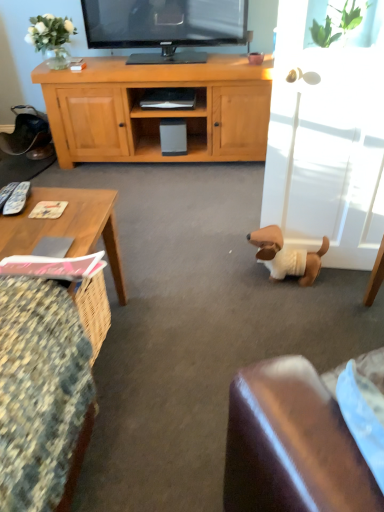
Where is `free point below white plush dog at lower right (from a real-world perspective)`? The image size is (384, 512). free point below white plush dog at lower right (from a real-world perspective) is located at coordinates (285, 279).